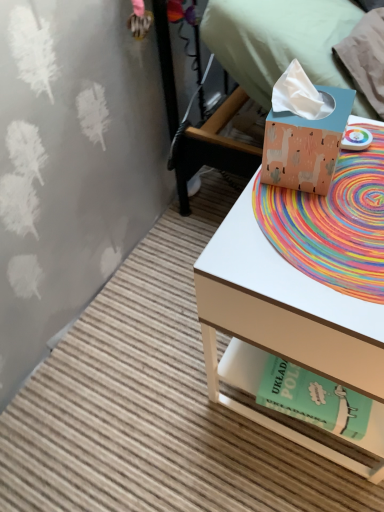
Question: Considering the relative sizes of green paper at lower right and matte cardboard tissue box at right in the image provided, is green paper at lower right shorter than matte cardboard tissue box at right?

Choices:
 (A) no
 (B) yes

Answer: (B)

Question: From a real-world perspective, is green paper at lower right positioned over matte cardboard tissue box at right based on gravity?

Choices:
 (A) no
 (B) yes

Answer: (A)

Question: Is green paper at lower right touching matte cardboard tissue box at right?

Choices:
 (A) yes
 (B) no

Answer: (B)

Question: Does green paper at lower right lie in front of matte cardboard tissue box at right?

Choices:
 (A) no
 (B) yes

Answer: (A)

Question: Does green paper at lower right lie behind matte cardboard tissue box at right?

Choices:
 (A) no
 (B) yes

Answer: (B)

Question: Considering the positions of matte peach tissue box at upper right and matte blue tissue box at upper right in the image, is matte peach tissue box at upper right taller or shorter than matte blue tissue box at upper right?

Choices:
 (A) short
 (B) tall

Answer: (A)

Question: From a real-world perspective, is matte peach tissue box at upper right positioned above or below matte blue tissue box at upper right?

Choices:
 (A) below
 (B) above

Answer: (B)

Question: In the image, is matte peach tissue box at upper right on the left side or the right side of matte blue tissue box at upper right?

Choices:
 (A) left
 (B) right

Answer: (A)

Question: Is matte peach tissue box at upper right bigger or smaller than matte blue tissue box at upper right?

Choices:
 (A) small
 (B) big

Answer: (A)

Question: From a real-world perspective, relative to matte peach tissue box at upper right, is green paper at lower right vertically above or below?

Choices:
 (A) below
 (B) above

Answer: (A)

Question: Relative to matte peach tissue box at upper right, is green paper at lower right in front or behind?

Choices:
 (A) front
 (B) behind

Answer: (B)

Question: Is green paper at lower right to the left or to the right of matte peach tissue box at upper right in the image?

Choices:
 (A) right
 (B) left

Answer: (A)

Question: Would you say green paper at lower right is inside or outside matte peach tissue box at upper right?

Choices:
 (A) outside
 (B) inside

Answer: (A)

Question: Is matte peach tissue box at upper right taller or shorter than green paper at lower right?

Choices:
 (A) short
 (B) tall

Answer: (B)

Question: Is matte peach tissue box at upper right inside the boundaries of green paper at lower right, or outside?

Choices:
 (A) inside
 (B) outside

Answer: (B)